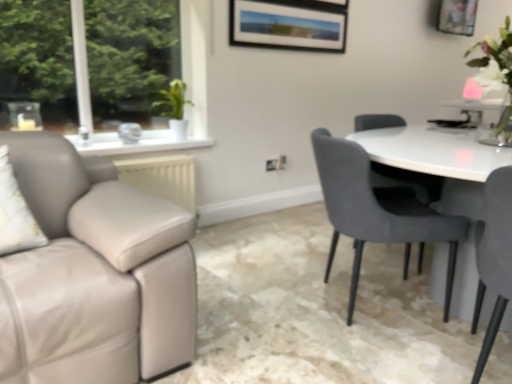
You are a GUI agent. You are given a task and a screenshot of the screen. Output one action in this format:
    pyautogui.click(x=<x>, y=<y>)
    Task: Click on the unoccupied space behind velvet grey chair at right, the 1th chair positioned from the back
    The image size is (512, 384).
    Given the screenshot: What is the action you would take?
    tap(338, 259)